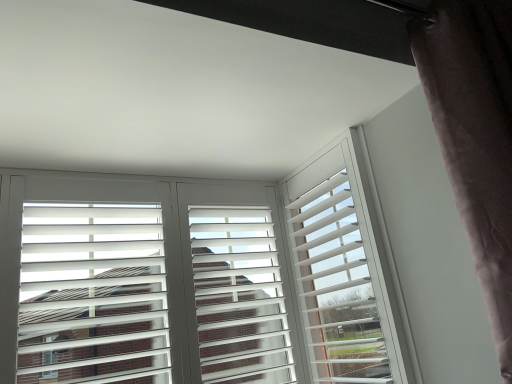
What do you see at coordinates (201, 278) in the screenshot?
I see `white matte shutters at center` at bounding box center [201, 278].

This screenshot has height=384, width=512. Describe the element at coordinates (343, 272) in the screenshot. I see `white matte window frame at center` at that location.

The height and width of the screenshot is (384, 512). Find the location of `white matte shutters at center`. white matte shutters at center is located at coordinates (201, 278).

Does point (434, 66) come behind point (319, 314)?

No, (434, 66) is closer to viewer.

Is dark velvet curtain at right spatially inside white matte window frame at center, or outside of it?

dark velvet curtain at right lies outside white matte window frame at center.

Which is more to the right, dark velvet curtain at right or white matte window frame at center?

dark velvet curtain at right.

Considering the sizes of objects white matte window frame at center and dark velvet curtain at right in the image provided, who is thinner, white matte window frame at center or dark velvet curtain at right?

Thinner between the two is white matte window frame at center.

Is white matte window frame at center turned away from dark velvet curtain at right?

That's not correct — white matte window frame at center is not looking away from dark velvet curtain at right.

Who is bigger, white matte window frame at center or dark velvet curtain at right?

dark velvet curtain at right.

Does point (301, 217) appear closer or farther from the camera than point (492, 72)?

Point (301, 217) appears to be farther away from the viewer than point (492, 72).

How different are the orientations of white matte window frame at center and white matte shutters at center in degrees?

The facing directions of white matte window frame at center and white matte shutters at center are 89.4 degrees apart.

Is white matte window frame at center looking in the opposite direction of white matte shutters at center?

white matte window frame at center is not turned away from white matte shutters at center.

From the image's perspective, between white matte window frame at center and white matte shutters at center, which one is located above?

From the image's view, white matte window frame at center is above.

From a real-world perspective, is white matte window frame at center physically above white matte shutters at center?

No.

In the scene shown: Is dark velvet curtain at right located outside white matte shutters at center?

Absolutely, dark velvet curtain at right is external to white matte shutters at center.

Between dark velvet curtain at right and white matte shutters at center, which one has smaller size?

white matte shutters at center.

Measure the distance between dark velvet curtain at right and white matte shutters at center.

A distance of 31.78 inches exists between dark velvet curtain at right and white matte shutters at center.

Is dark velvet curtain at right with white matte shutters at center?

No, dark velvet curtain at right is not beside white matte shutters at center.

Is white matte shutters at center turned away from white matte window frame at center?

No.

Consider the image. Which of these two, white matte shutters at center or white matte window frame at center, stands shorter?

white matte window frame at center.

In terms of size, does white matte shutters at center appear bigger or smaller than white matte window frame at center?

Considering their sizes, white matte shutters at center takes up more space than white matte window frame at center.

Which is in front, point (226, 187) or point (454, 98)?

Point (454, 98)

Is white matte shutters at center completely or partially outside of dark velvet curtain at right?

Yes, white matte shutters at center is outside of dark velvet curtain at right.

This screenshot has height=384, width=512. In order to click on window frame located on the left of dark velvet curtain at right in this screenshot , I will do `click(343, 272)`.

At what (x,y) coordinates should I click in order to perform the action: click on window frame that appears behind the dark velvet curtain at right. Please return your answer as a coordinate pair (x, y). Looking at the image, I should click on (343, 272).

Estimate the real-world distances between objects in this image. Which object is further from white matte window frame at center, dark velvet curtain at right or white matte shutters at center?

dark velvet curtain at right is further to white matte window frame at center.

Looking at the image, which one is located further to white matte shutters at center, white matte window frame at center or dark velvet curtain at right?

dark velvet curtain at right is positioned further to the anchor white matte shutters at center.

Consider the image. Considering their positions, is white matte window frame at center positioned further to dark velvet curtain at right than white matte shutters at center?

white matte shutters at center.

From the image, which object appears to be farther from white matte shutters at center, dark velvet curtain at right or white matte window frame at center?

Based on the image, dark velvet curtain at right appears to be further to white matte shutters at center.

Estimate the real-world distances between objects in this image. Which object is further from white matte window frame at center, white matte shutters at center or dark velvet curtain at right?

Among the two, dark velvet curtain at right is located further to white matte window frame at center.

Looking at the image, which one is located closer to dark velvet curtain at right, white matte shutters at center or white matte window frame at center?

white matte window frame at center is positioned closer to the anchor dark velvet curtain at right.

This screenshot has height=384, width=512. In order to click on window frame between white matte shutters at center and dark velvet curtain at right from left to right in this screenshot , I will do `click(343, 272)`.